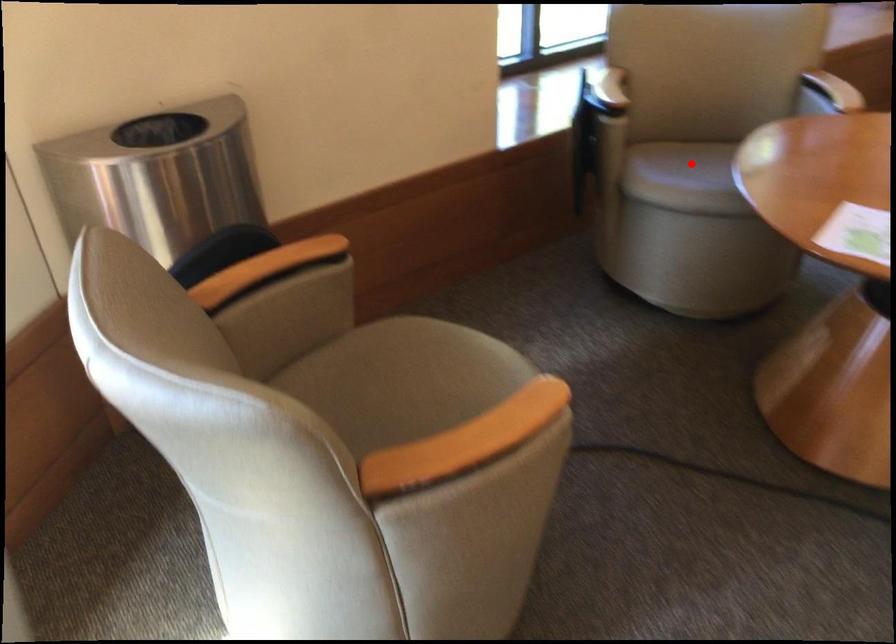
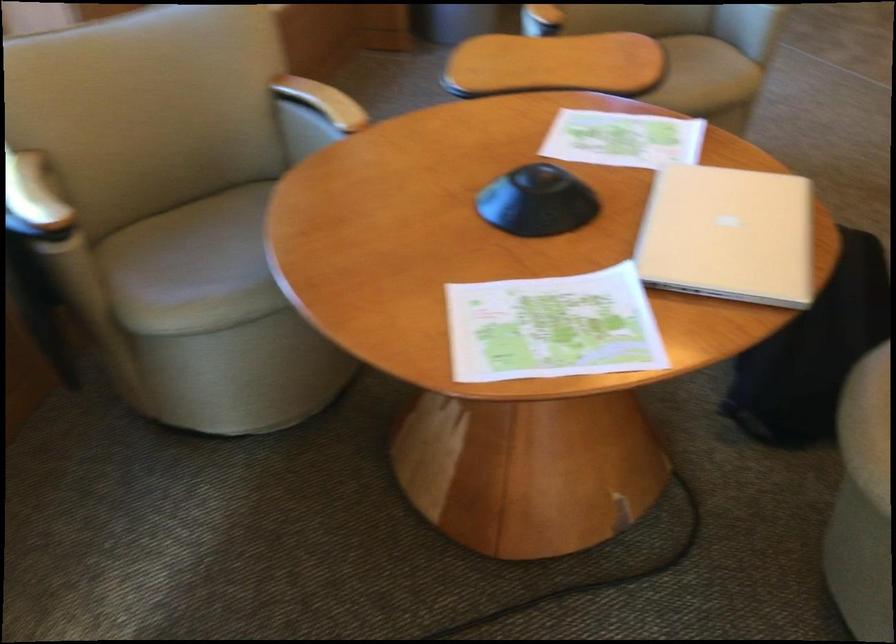
Question: I am providing you with two images of the same scene from different viewpoints. Image1 has a red point marked. In image2, the corresponding 3D location appears at what relative position? Reply with the corresponding letter.

Choices:
 (A) Closer
 (B) Farther

Answer: (A)